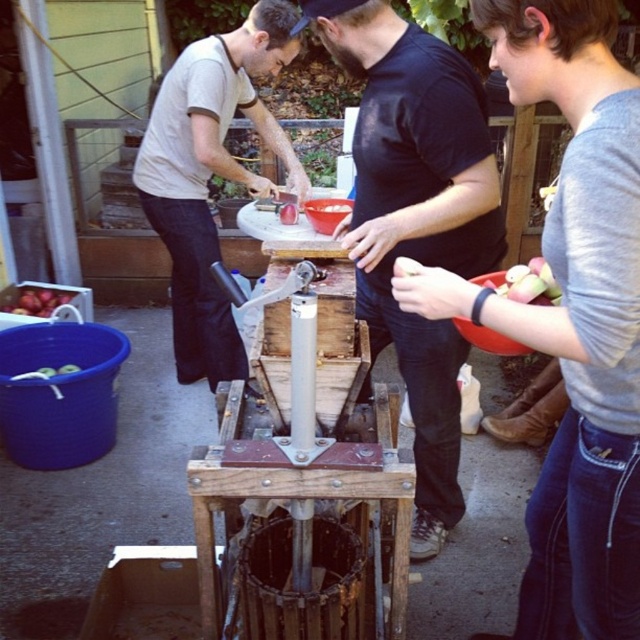
Question: Among these points, which one is farthest from the camera?

Choices:
 (A) (196, 144)
 (B) (358, 22)
 (C) (612, 284)
 (D) (22, 300)

Answer: (D)

Question: Which of the following is the closest to the observer?

Choices:
 (A) matte red apples at left
 (B) gray cotton shirt at upper right
 (C) black matte shirt at center
 (D) matte white shirt at upper left

Answer: (B)

Question: From the image, what is the correct spatial relationship of matte white shirt at upper left in relation to matte red apples at left?

Choices:
 (A) above
 (B) below

Answer: (A)

Question: In this image, where is black matte shirt at center located relative to matte red apples at left?

Choices:
 (A) right
 (B) left

Answer: (A)

Question: Considering the real-world distances, which object is closest to the matte white shirt at upper left?

Choices:
 (A) black matte shirt at center
 (B) gray cotton shirt at upper right

Answer: (A)

Question: Does gray cotton shirt at upper right appear over matte red apples at left?

Choices:
 (A) no
 (B) yes

Answer: (A)